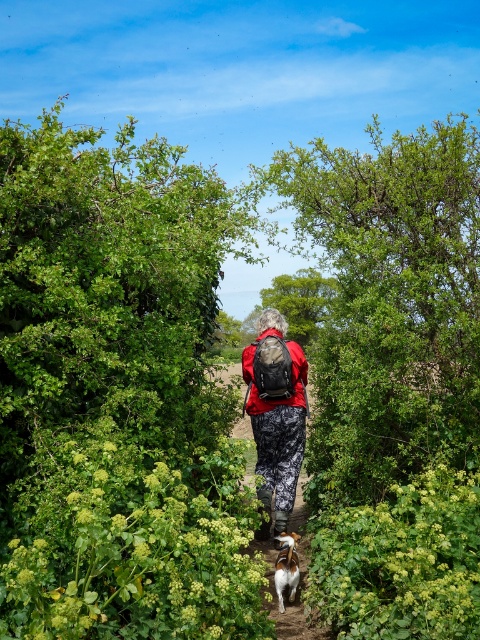
Question: Does matte black backpack at center appear on the right side of white fur dog at center?

Choices:
 (A) yes
 (B) no

Answer: (B)

Question: Which object is positioned closest to the white fur dog at center?

Choices:
 (A) matte black backpack at center
 (B) camouflage-patterned pants at center

Answer: (A)

Question: Which object is positioned closest to the camouflage-patterned pants at center?

Choices:
 (A) white fur dog at center
 (B) matte black backpack at center

Answer: (A)

Question: Is camouflage-patterned pants at center below white fur dog at center?

Choices:
 (A) yes
 (B) no

Answer: (B)

Question: Is the position of camouflage-patterned pants at center more distant than that of white fur dog at center?

Choices:
 (A) no
 (B) yes

Answer: (A)

Question: Which of the following is the closest to the observer?

Choices:
 (A) (280, 636)
 (B) (278, 540)
 (C) (287, 458)

Answer: (A)